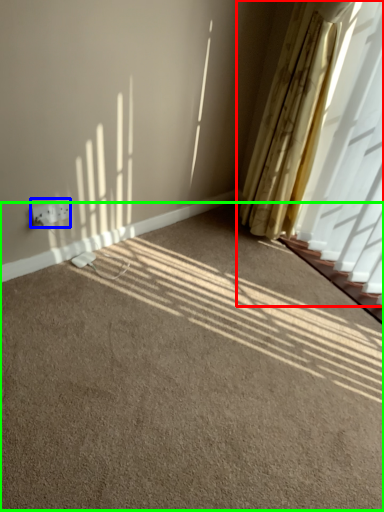
Question: Which object is positioned farthest from curtain (highlighted by a red box)? Select from electric outlet (highlighted by a blue box) and plain (highlighted by a green box).

Choices:
 (A) electric outlet
 (B) plain

Answer: (A)